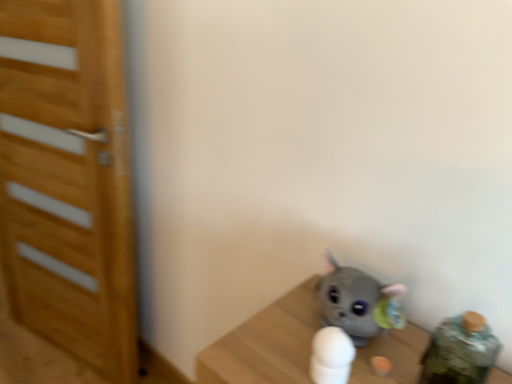
This screenshot has height=384, width=512. Describe the element at coordinates (331, 356) in the screenshot. I see `white matte toy at center` at that location.

What are the coordinates of `white matte toy at center` in the screenshot? It's located at (331, 356).

Measure the distance between point (x=7, y=181) and camera.

The distance of point (x=7, y=181) from camera is 5.96 feet.

What is the approximate height of wooden door at left?

It is 1.53 meters.

This screenshot has height=384, width=512. What do you see at coordinates (68, 183) in the screenshot?
I see `wooden door at left` at bounding box center [68, 183].

Locate an element on the screen. This screenshot has width=512, height=384. wooden door at left is located at coordinates (68, 183).

The height and width of the screenshot is (384, 512). I want to click on white matte toy at center, so click(331, 356).

Visually, is wooden door at left positioned to the left or to the right of white matte toy at center?

wooden door at left is positioned on white matte toy at center's left side.

Does wooden door at left come behind white matte toy at center?

Yes, it is behind white matte toy at center.

Considering the points (103, 147) and (318, 382), which point is behind, point (103, 147) or point (318, 382)?

The point (103, 147) is farther.

From the image's perspective, relative to white matte toy at center, is wooden door at left above or below?

wooden door at left is situated higher than white matte toy at center in the image.

From a real-world perspective, between wooden door at left and white matte toy at center, who is vertically higher?

white matte toy at center is physically above.

Considering the sizes of objects wooden door at left and white matte toy at center in the image provided, who is thinner, wooden door at left or white matte toy at center?

white matte toy at center is thinner.

In the scene shown: Considering the relative sizes of wooden door at left and white matte toy at center in the image provided, is wooden door at left shorter than white matte toy at center?

Incorrect, the height of wooden door at left does not fall short of that of white matte toy at center.

Is wooden door at left smaller than white matte toy at center?

No.

Looking at this image, is wooden door at left positioned beyond the bounds of white matte toy at center?

Yes, wooden door at left is located beyond the bounds of white matte toy at center.

From the picture: Is wooden door at left beside white matte toy at center?

There is a gap between wooden door at left and white matte toy at center.

Is wooden door at left turned away from white matte toy at center?

No, wooden door at left is not facing the opposite direction of white matte toy at center.

The width and height of the screenshot is (512, 384). What are the coordinates of `door that is above the white matte toy at center (from the image's perspective)` in the screenshot? It's located at (68, 183).

Between white matte toy at center and wooden door at left, which one appears on the left side from the viewer's perspective?

From the viewer's perspective, wooden door at left appears more on the left side.

Is white matte toy at center positioned behind wooden door at left?

No, white matte toy at center is in front of wooden door at left.

Is point (340, 379) behind point (73, 346)?

No, it is in front of (73, 346).

From the image's perspective, which is above, white matte toy at center or wooden door at left?

wooden door at left.

From a real-world perspective, is white matte toy at center positioned above or below wooden door at left?

In terms of real-world spatial position, white matte toy at center is above wooden door at left.

Looking at their sizes, would you say white matte toy at center is wider or thinner than wooden door at left?

Clearly, white matte toy at center has less width compared to wooden door at left.

Is white matte toy at center shorter than wooden door at left?

Yes, white matte toy at center is shorter than wooden door at left.

Which of these two, white matte toy at center or wooden door at left, is smaller?

With smaller size is white matte toy at center.

Is white matte toy at center inside the boundaries of wooden door at left, or outside?

white matte toy at center is not inside wooden door at left, it's outside.

Can you see white matte toy at center touching wooden door at left?

white matte toy at center is not next to wooden door at left, and they're not touching.

Is white matte toy at center aimed at wooden door at left?

No, white matte toy at center is not turned towards wooden door at left.

How many degrees apart are the facing directions of white matte toy at center and wooden door at left?

They differ by 14.5 degrees in their facing directions.

Measure the distance from white matte toy at center to wooden door at left.

A distance of 3.93 feet exists between white matte toy at center and wooden door at left.

Find the location of `door that is under the white matte toy at center (from a real-world perspective)`. door that is under the white matte toy at center (from a real-world perspective) is located at coordinates (68, 183).

The height and width of the screenshot is (384, 512). I want to click on toy in front of the wooden door at left, so click(x=331, y=356).

Locate an element on the screen. toy above the wooden door at left (from a real-world perspective) is located at coordinates (331, 356).